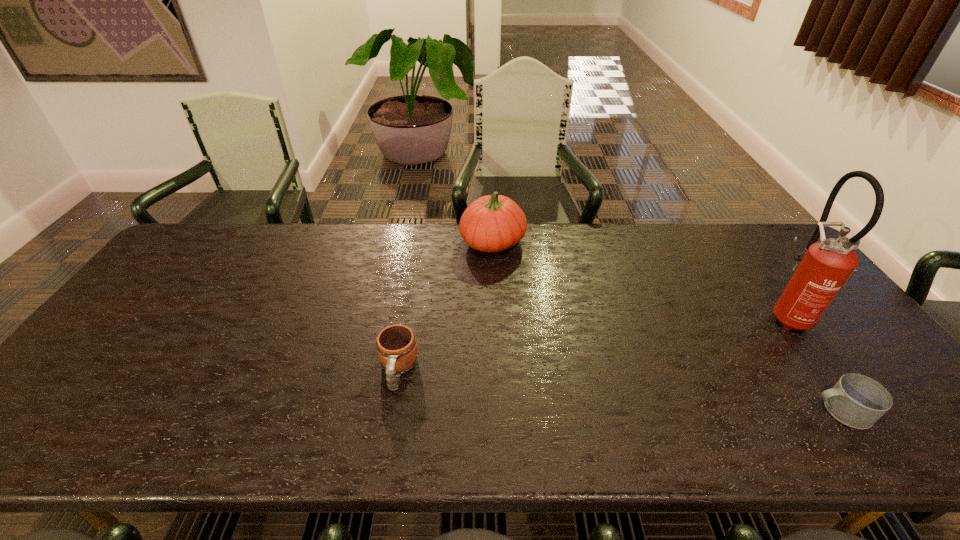
Locate an element on the screen. This screenshot has height=540, width=960. the second farthest object is located at coordinates (822, 269).

Image resolution: width=960 pixels, height=540 pixels. Identify the location of fire extinguisher. (822, 269).

At what (x,y) coordinates should I click in order to perform the action: click on the farthest object. Please return your answer as a coordinate pair (x, y). The width and height of the screenshot is (960, 540). Looking at the image, I should click on (493, 223).

The image size is (960, 540). I want to click on the third shortest object, so click(x=493, y=223).

In order to click on the taller mug in this screenshot , I will do `click(396, 345)`.

Where is `the third tallest object`? The height and width of the screenshot is (540, 960). the third tallest object is located at coordinates (396, 345).

Locate an element on the screen. The height and width of the screenshot is (540, 960). the shortest object is located at coordinates (857, 401).

Identify the location of the right mug. This screenshot has height=540, width=960. (857, 401).

The image size is (960, 540). I want to click on free space located 0.400m at the nozzle of the fire extinguisher, so click(623, 316).

In order to click on vacant space located at the nozzle of the fire extinguisher in this screenshot , I will do `click(746, 316)`.